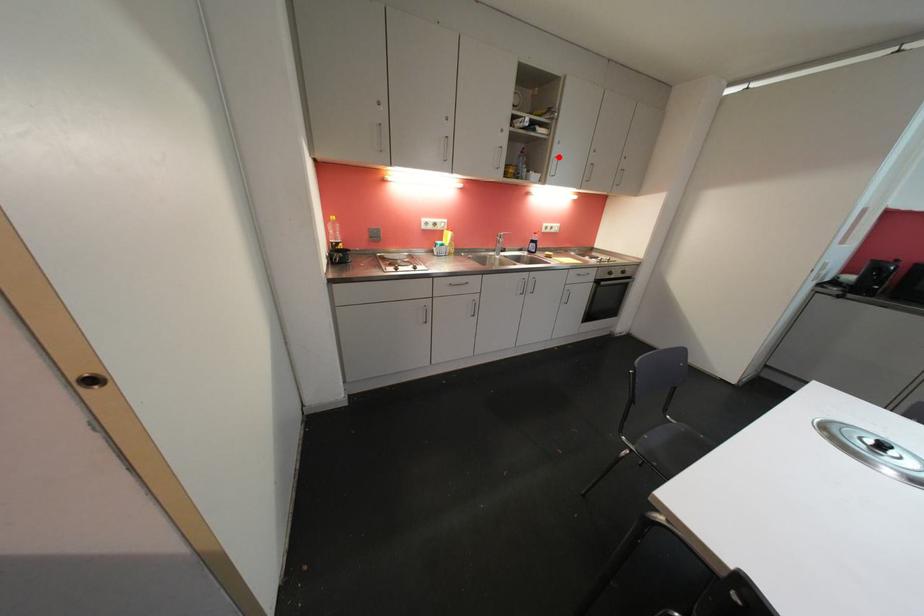
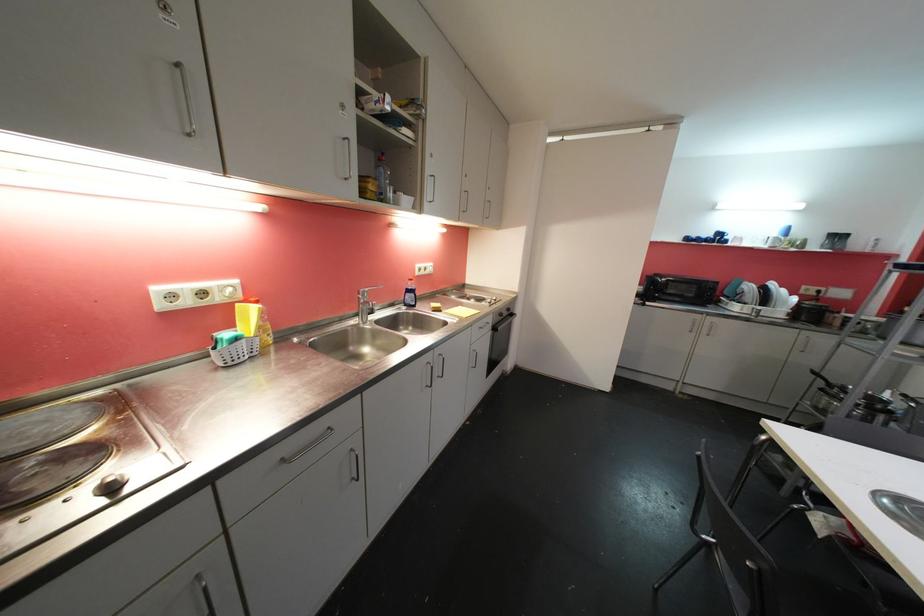
The point at the highlighted location is marked in the first image. Where is the corresponding point in the second image?

(432, 174)